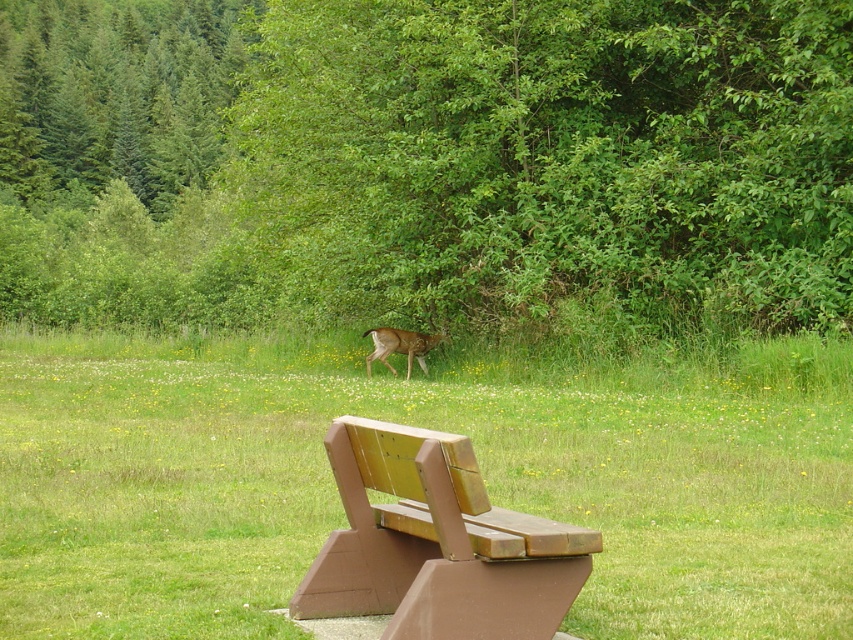
Question: Which object appears closest to the camera in this image?

Choices:
 (A) green grass at center
 (B) brown wood bench at lower center
 (C) brown fur deer at center

Answer: (B)

Question: Is green leafy tree at center positioned at the back of brown wood bench at lower center?

Choices:
 (A) yes
 (B) no

Answer: (A)

Question: Estimate the real-world distances between objects in this image. Which object is closer to the green grass at center?

Choices:
 (A) green leafy tree at center
 (B) brown wood bench at lower center

Answer: (B)

Question: Does green leafy tree at center appear on the right side of green grass at center?

Choices:
 (A) yes
 (B) no

Answer: (B)

Question: Which is nearer to the green grass at center?

Choices:
 (A) brown wood bench at lower center
 (B) green leafy tree at center
 (C) brown fur deer at center

Answer: (C)

Question: Is brown wood bench at lower center further to camera compared to brown fur deer at center?

Choices:
 (A) yes
 (B) no

Answer: (B)